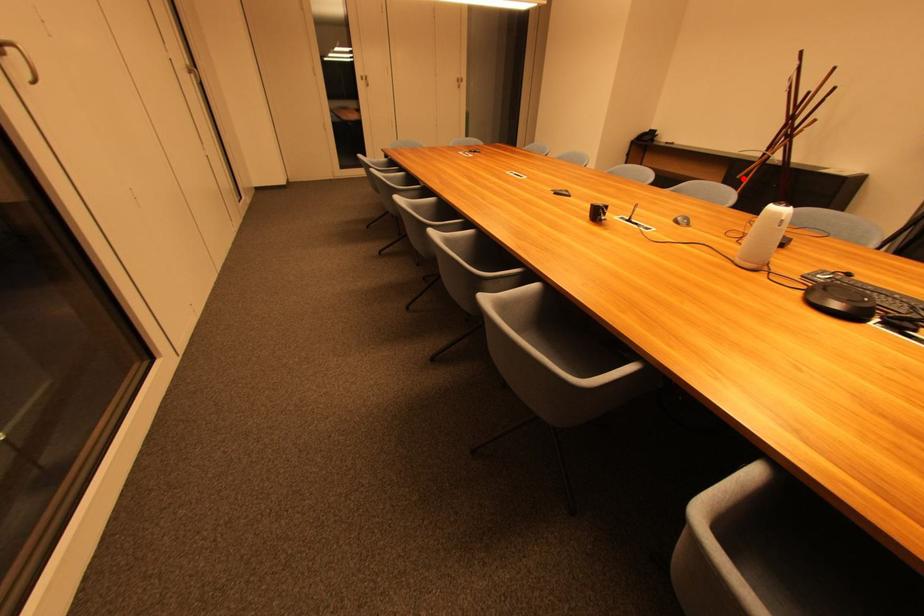
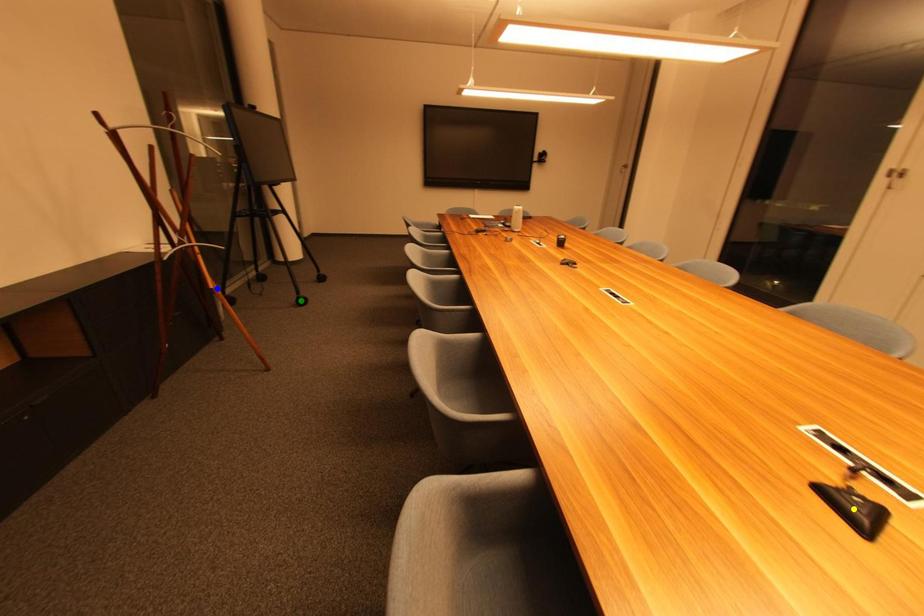
Question: I am providing you with two images of the same scene from different viewpoints. A red point is marked on the first image. You are given multiple points on the second image. In image 2, which mark is for the same physical point as the one in image 1?

Choices:
 (A) blue point
 (B) yellow point
 (C) green point

Answer: (A)